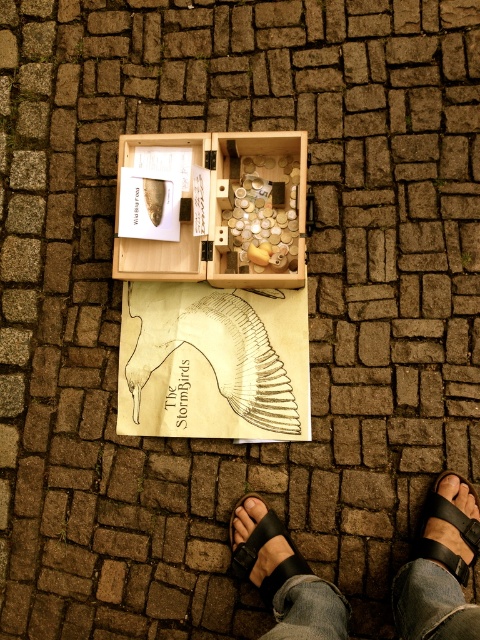
Question: Which point is closer to the camera taking this photo?

Choices:
 (A) (467, 484)
 (B) (276, 573)
 (C) (456, 536)

Answer: (C)

Question: Where is wooden box at center located in relation to black leather sandal at lower right in the image?

Choices:
 (A) right
 (B) left

Answer: (B)

Question: Observing the image, what is the correct spatial positioning of black leather sandals at lower center in reference to black leather sandal at lower center?

Choices:
 (A) right
 (B) left

Answer: (A)

Question: Which point is closer to the camera?

Choices:
 (A) wooden box at center
 (B) black leather sandals at lower center
 (C) black leather sandal at lower center
 (D) black leather sandal at lower right

Answer: (B)

Question: Based on their relative distances, which object is farther from the black leather sandal at lower center?

Choices:
 (A) wooden box at center
 (B) black leather sandal at lower right

Answer: (A)

Question: Is black leather sandal at lower right to the left of black leather sandal at lower center from the viewer's perspective?

Choices:
 (A) no
 (B) yes

Answer: (A)